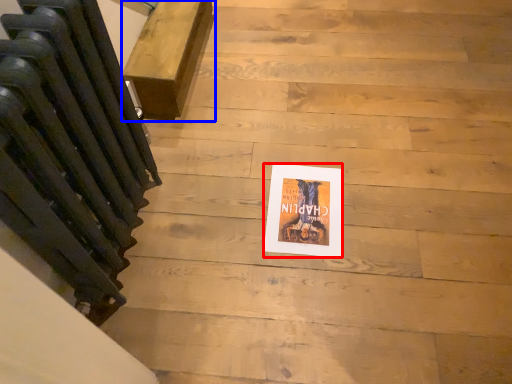
Question: Among these objects, which one is nearest to the camera, flyer (highlighted by a red box) or furniture (highlighted by a blue box)?

Choices:
 (A) flyer
 (B) furniture

Answer: (A)